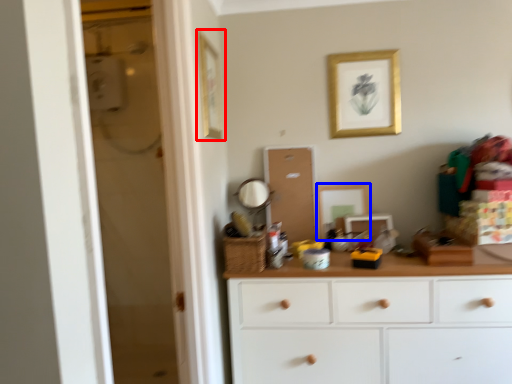
Question: Which object appears farthest to the camera in this image, picture frame (highlighted by a red box) or picture frame (highlighted by a blue box)?

Choices:
 (A) picture frame
 (B) picture frame

Answer: (B)